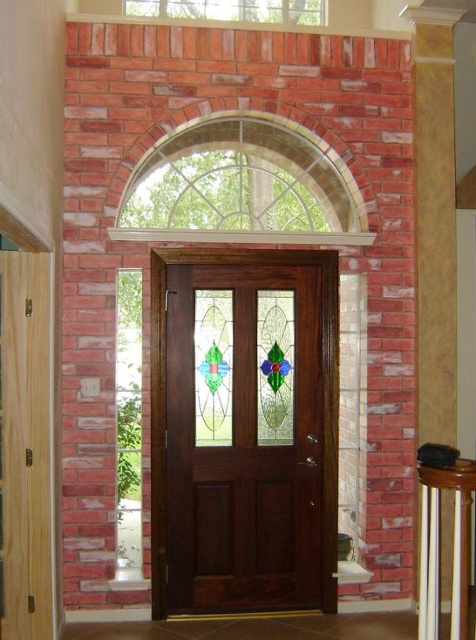
Who is positioned more to the right, clear stained glass at left or clear glass window at upper center?

clear glass window at upper center

Between clear stained glass at left and clear glass window at upper center, which one appears on the left side from the viewer's perspective?

clear stained glass at left is more to the left.

Who is more forward, (x=130, y=317) or (x=264, y=12)?

Point (x=130, y=317) is in front.

Where is `clear stained glass at left`? Image resolution: width=476 pixels, height=640 pixels. clear stained glass at left is located at coordinates (128, 422).

Between mahogany wood door at center and clear stained glass at left, which one appears on the right side from the viewer's perspective?

mahogany wood door at center is more to the right.

Who is taller, mahogany wood door at center or clear stained glass at left?

With more height is mahogany wood door at center.

Identify the location of mahogany wood door at center. Image resolution: width=476 pixels, height=640 pixels. (323, 388).

Between clear glass window at center and mahogany wood door at center, which one is positioned lower?

mahogany wood door at center is lower down.

Does clear glass window at center have a lesser width compared to mahogany wood door at center?

No.

Find the location of a particular element. The height and width of the screenshot is (640, 476). clear glass window at center is located at coordinates (241, 186).